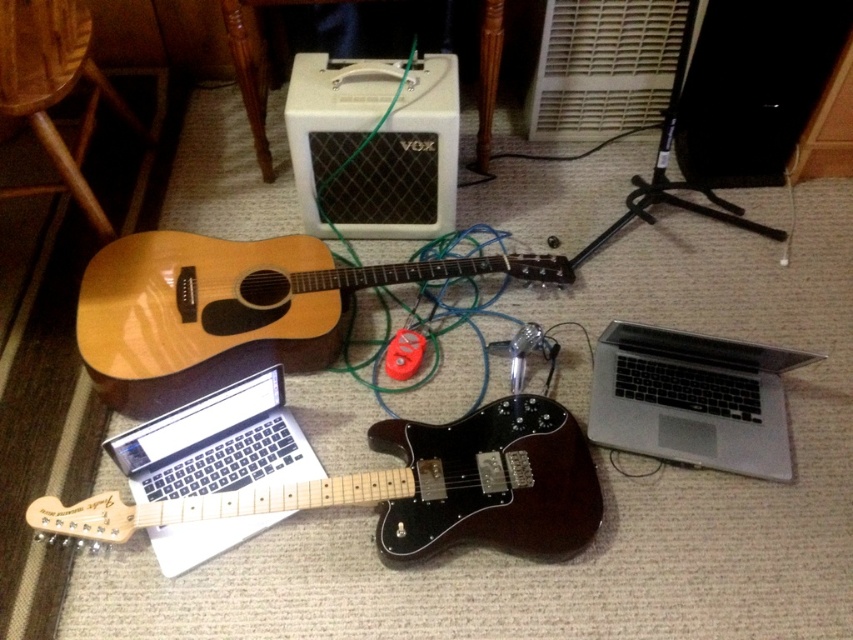
You are a photographer setting up for a music session. You have two points marked in the scene for lighting adjustments. The first point is at coordinate point [225,326] and the second is at point [36,48]. Which point is closer to you?

Point [225,326] is closer to the viewer than point [36,48].

You are a musician who needs to move the natural wood acoustic guitar at center to the left side of the wooden stool at lower left. Can you do this without moving the stool?

The natural wood acoustic guitar at center is currently to the right of the wooden stool at lower left. To move it to the left side of the stool, you would need to shift the guitar around or behind the stool, as moving it directly left might not be possible without repositioning the stool itself.

You are setting up a music studio and need to place the natural wood acoustic guitar at center and the silver metallic laptop at lower right on a shelf. The shelf has a height limit of 30 cm. The acoustic guitar is 25 cm tall, and the laptop is 35 cm tall. Can both items fit on the shelf vertically?

The natural wood acoustic guitar at center is 25 cm tall and the silver metallic laptop at lower right is 35 cm tall. Since the shelf has a height limit of 30 cm, the acoustic guitar can fit vertically, but the laptop exceeds the height limit and cannot fit.